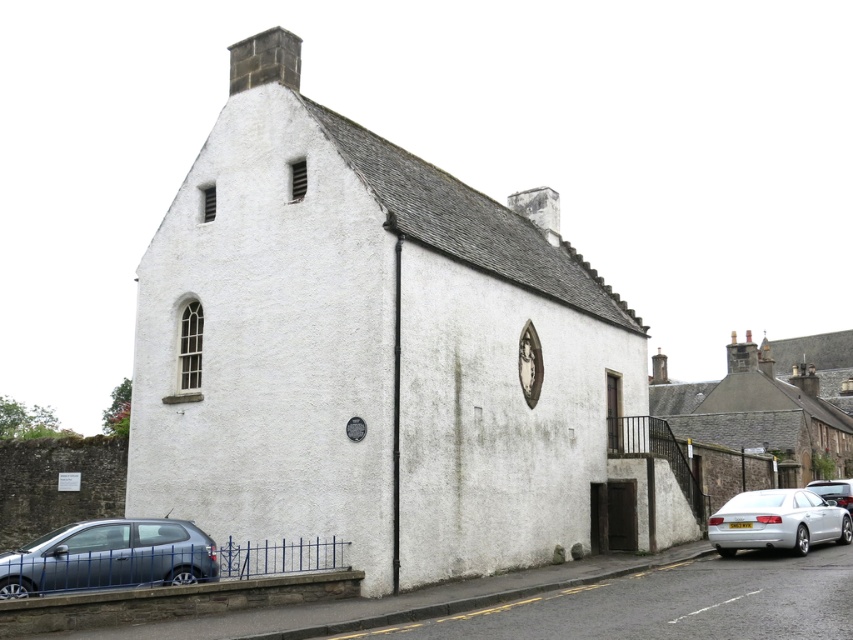
Can you confirm if metallic gray hatchback at lower left is positioned below silver metallic car at lower right?

No.

Is point (85, 577) less distant than point (811, 481)?

That is True.

The width and height of the screenshot is (853, 640). What are the coordinates of `metallic gray hatchback at lower left` in the screenshot? It's located at (109, 556).

What do you see at coordinates (109, 556) in the screenshot? I see `metallic gray hatchback at lower left` at bounding box center [109, 556].

Is metallic gray hatchback at lower left thinner than silver metallic sedan at lower right?

Indeed, metallic gray hatchback at lower left has a lesser width compared to silver metallic sedan at lower right.

Describe the element at coordinates (109, 556) in the screenshot. I see `metallic gray hatchback at lower left` at that location.

Where is `metallic gray hatchback at lower left`? This screenshot has height=640, width=853. metallic gray hatchback at lower left is located at coordinates (109, 556).

This screenshot has width=853, height=640. In order to click on silver metallic sedan at lower right in this screenshot , I will do pos(776,522).

Does silver metallic sedan at lower right appear on the right side of silver metallic car at lower right?

Incorrect, silver metallic sedan at lower right is not on the right side of silver metallic car at lower right.

The width and height of the screenshot is (853, 640). I want to click on silver metallic sedan at lower right, so click(x=776, y=522).

Identify the location of silver metallic sedan at lower right. (776, 522).